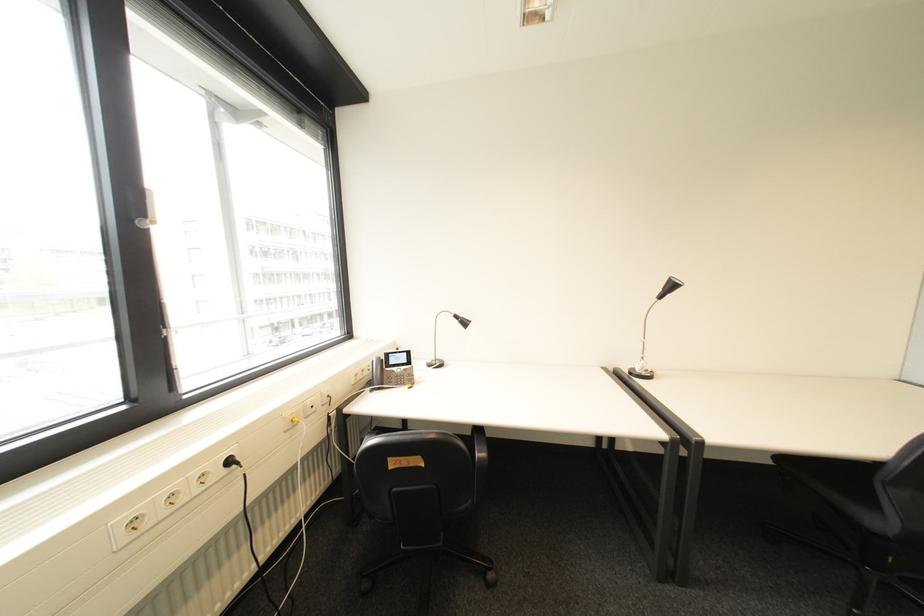
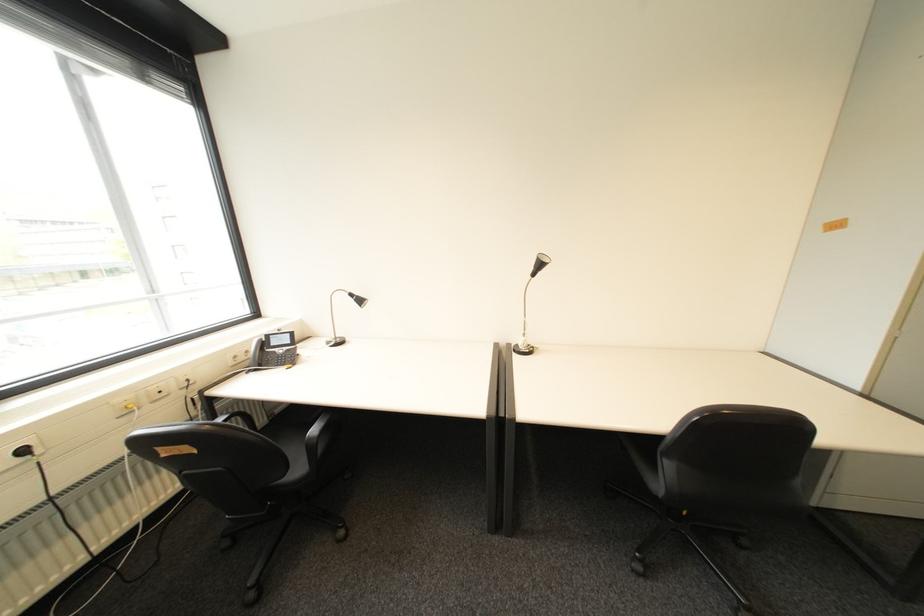
Find the pixel in the second image that matches point (467, 322) in the first image.

(362, 301)